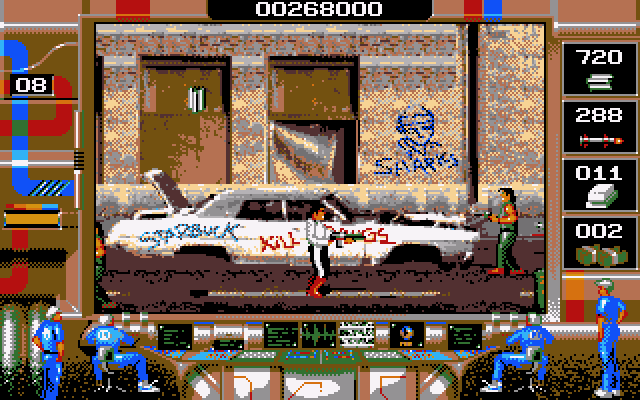
Where is `monitors`? monitors is located at coordinates (180, 339), (226, 345), (280, 339), (315, 336), (362, 334), (401, 335), (467, 338).